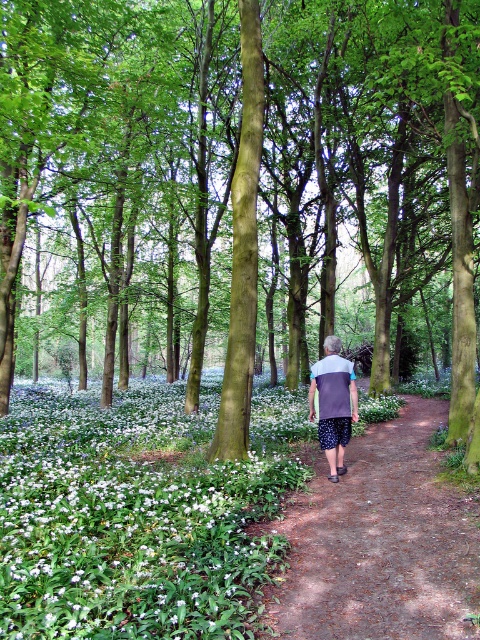
Question: Is green smooth tree trunk at center positioned before gray fabric shirt at center?

Choices:
 (A) yes
 (B) no

Answer: (A)

Question: Which object appears closest to the camera in this image?

Choices:
 (A) brown dirt path at center
 (B) green smooth tree trunk at center
 (C) white matte flowers at lower left

Answer: (C)

Question: Is green smooth tree trunk at center to the right of brown dirt path at center from the viewer's perspective?

Choices:
 (A) no
 (B) yes

Answer: (A)

Question: Is white matte flowers at lower left to the right of gray fabric shirt at center from the viewer's perspective?

Choices:
 (A) no
 (B) yes

Answer: (A)

Question: Which object appears closest to the camera in this image?

Choices:
 (A) brown dirt path at center
 (B) green smooth tree trunk at center

Answer: (A)

Question: Which point is farther to the camera?

Choices:
 (A) brown dirt path at center
 (B) white matte flowers at lower left

Answer: (A)